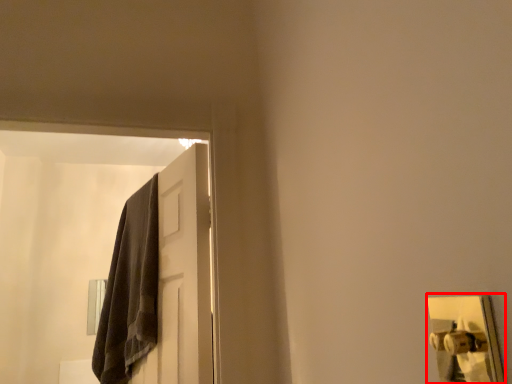
Question: From the image's perspective, where is door handle (annotated by the red box) located in relation to door in the image?

Choices:
 (A) below
 (B) above

Answer: (B)